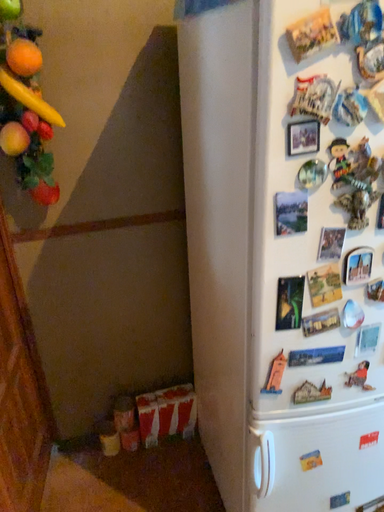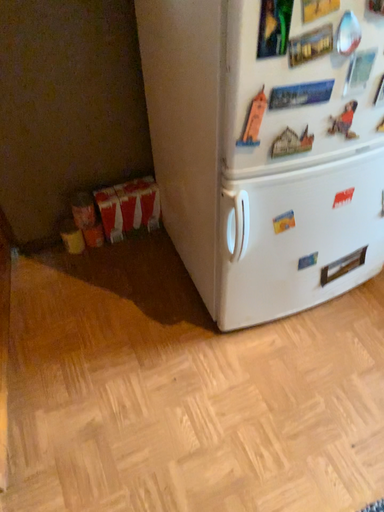
Question: How did the camera likely rotate when shooting the video?

Choices:
 (A) rotated left
 (B) rotated right

Answer: (B)